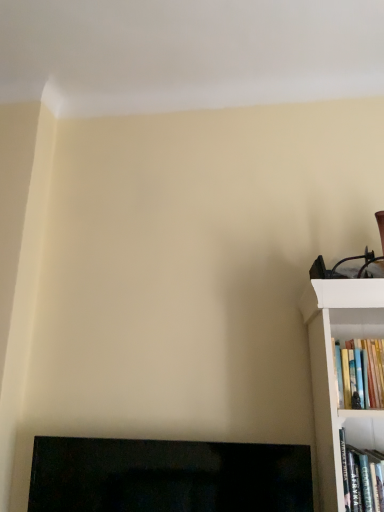
This screenshot has width=384, height=512. What are the coordinates of `hardcover book at right, the 1th book when ordered from bottom to top` in the screenshot? It's located at (361, 478).

What do you see at coordinates (168, 476) in the screenshot? The image size is (384, 512). I see `black glossy fireplace at lower left` at bounding box center [168, 476].

What is the approximate width of black glossy fireplace at lower left?

9.19 centimeters.

What do you see at coordinates (360, 373) in the screenshot?
I see `hardcover books at right, placed as the second book when sorted from bottom to top` at bounding box center [360, 373].

Where is `hardcover books at right, positioned as the first book in top-to-bottom order`? hardcover books at right, positioned as the first book in top-to-bottom order is located at coordinates (360, 373).

Locate an element on the screen. The width and height of the screenshot is (384, 512). hardcover book at right, the 1th book when ordered from bottom to top is located at coordinates (361, 478).

Considering the positions of objects hardcover book at right, the 1th book when ordered from bottom to top, and black glossy fireplace at lower left in the image provided, who is more to the right, hardcover book at right, the 1th book when ordered from bottom to top, or black glossy fireplace at lower left?

hardcover book at right, the 1th book when ordered from bottom to top.

Who is more distant, hardcover book at right, the 1th book when ordered from bottom to top, or black glossy fireplace at lower left?

black glossy fireplace at lower left.

Does hardcover book at right, which ranks as the second book in top-to-bottom order, turn towards black glossy fireplace at lower left?

No, hardcover book at right, which ranks as the second book in top-to-bottom order, is not facing towards black glossy fireplace at lower left.

Between hardcover book at right, which ranks as the second book in top-to-bottom order, and hardcover books at right, positioned as the first book in top-to-bottom order, which one has larger width?

hardcover book at right, which ranks as the second book in top-to-bottom order.

From a real-world perspective, is hardcover book at right, the 1th book when ordered from bottom to top, above or below hardcover books at right, positioned as the first book in top-to-bottom order?

From a real-world perspective, hardcover book at right, the 1th book when ordered from bottom to top, is physically below hardcover books at right, positioned as the first book in top-to-bottom order.

Is point (343, 478) closer or farther from the camera than point (345, 383)?

Point (343, 478) appears to be closer to the viewer than point (345, 383).

Is hardcover book at right, which ranks as the second book in top-to-bottom order, turned away from hardcover books at right, positioned as the first book in top-to-bottom order?

That's not correct — hardcover book at right, which ranks as the second book in top-to-bottom order, is not looking away from hardcover books at right, positioned as the first book in top-to-bottom order.

Is black glossy fireplace at lower left positioned beyond the bounds of hardcover books at right, placed as the second book when sorted from bottom to top?

Yes, black glossy fireplace at lower left is outside of hardcover books at right, placed as the second book when sorted from bottom to top.

From the image's perspective, which is below, black glossy fireplace at lower left or hardcover books at right, placed as the second book when sorted from bottom to top?

From the image's view, black glossy fireplace at lower left is below.

Considering the relative sizes of black glossy fireplace at lower left and hardcover books at right, placed as the second book when sorted from bottom to top, in the image provided, is black glossy fireplace at lower left wider than hardcover books at right, placed as the second book when sorted from bottom to top,?

No, black glossy fireplace at lower left is not wider than hardcover books at right, placed as the second book when sorted from bottom to top.

Looking at this image, which is in front, black glossy fireplace at lower left or hardcover books at right, placed as the second book when sorted from bottom to top?

hardcover books at right, placed as the second book when sorted from bottom to top, is closer to the camera.

Considering the points (140, 465) and (372, 479), which point is behind, point (140, 465) or point (372, 479)?

Point (140, 465)

Is black glossy fireplace at lower left further to camera compared to hardcover book at right, which ranks as the second book in top-to-bottom order?

Yes, black glossy fireplace at lower left is further from the viewer.

Does black glossy fireplace at lower left have a smaller size compared to hardcover book at right, which ranks as the second book in top-to-bottom order?

No.

From a real-world perspective, between black glossy fireplace at lower left and hardcover book at right, the 1th book when ordered from bottom to top, who is vertically higher?

From a 3D spatial view, hardcover book at right, the 1th book when ordered from bottom to top, is above.

Does hardcover books at right, placed as the second book when sorted from bottom to top, appear on the left side of hardcover book at right, which ranks as the second book in top-to-bottom order?

Yes.

From the image's perspective, is hardcover books at right, positioned as the first book in top-to-bottom order, positioned above or below hardcover book at right, which ranks as the second book in top-to-bottom order?

hardcover books at right, positioned as the first book in top-to-bottom order, is situated higher than hardcover book at right, which ranks as the second book in top-to-bottom order, in the image.

What's the angular difference between hardcover books at right, placed as the second book when sorted from bottom to top, and hardcover book at right, the 1th book when ordered from bottom to top,'s facing directions?

hardcover books at right, placed as the second book when sorted from bottom to top, and hardcover book at right, the 1th book when ordered from bottom to top, are facing 0.217 degrees away from each other.

From a real-world perspective, which is physically above, hardcover books at right, placed as the second book when sorted from bottom to top, or hardcover book at right, which ranks as the second book in top-to-bottom order?

hardcover books at right, placed as the second book when sorted from bottom to top, from a real-world perspective.

Does hardcover books at right, positioned as the first book in top-to-bottom order, touch black glossy fireplace at lower left?

No, hardcover books at right, positioned as the first book in top-to-bottom order, is not touching black glossy fireplace at lower left.

In terms of height, does hardcover books at right, placed as the second book when sorted from bottom to top, look taller or shorter compared to black glossy fireplace at lower left?

hardcover books at right, placed as the second book when sorted from bottom to top, is shorter than black glossy fireplace at lower left.

Which of these two, hardcover books at right, positioned as the first book in top-to-bottom order, or black glossy fireplace at lower left, is wider?

hardcover books at right, positioned as the first book in top-to-bottom order, is wider.

You are a GUI agent. You are given a task and a screenshot of the screen. Output one action in this format:
    pyautogui.click(x=<x>, y=<y>)
    Task: Click on the 1st book above the black glossy fireplace at lower left (from the image's perspective)
    
    Given the screenshot: What is the action you would take?
    pyautogui.click(x=361, y=478)

In the image, there is a hardcover books at right, placed as the second book when sorted from bottom to top. Identify the location of book below it (from the image's perspective). Image resolution: width=384 pixels, height=512 pixels. (361, 478).

Considering their positions, is hardcover books at right, positioned as the first book in top-to-bottom order, positioned closer to hardcover book at right, which ranks as the second book in top-to-bottom order, than black glossy fireplace at lower left?

Based on the image, hardcover books at right, positioned as the first book in top-to-bottom order, appears to be nearer to hardcover book at right, which ranks as the second book in top-to-bottom order.

When comparing their distances from hardcover books at right, positioned as the first book in top-to-bottom order, does black glossy fireplace at lower left or hardcover book at right, which ranks as the second book in top-to-bottom order, seem closer?

Among the two, hardcover book at right, which ranks as the second book in top-to-bottom order, is located nearer to hardcover books at right, positioned as the first book in top-to-bottom order.

Which object lies nearer to the anchor point black glossy fireplace at lower left, hardcover book at right, which ranks as the second book in top-to-bottom order, or hardcover books at right, placed as the second book when sorted from bottom to top?

hardcover book at right, which ranks as the second book in top-to-bottom order, lies closer to black glossy fireplace at lower left than the other object.

When comparing their distances from black glossy fireplace at lower left, does hardcover books at right, positioned as the first book in top-to-bottom order, or hardcover book at right, which ranks as the second book in top-to-bottom order, seem further?

The object further to black glossy fireplace at lower left is hardcover books at right, positioned as the first book in top-to-bottom order.

Considering their positions, is hardcover book at right, which ranks as the second book in top-to-bottom order, positioned closer to hardcover books at right, positioned as the first book in top-to-bottom order, than black glossy fireplace at lower left?

hardcover book at right, which ranks as the second book in top-to-bottom order, lies closer to hardcover books at right, positioned as the first book in top-to-bottom order, than the other object.

From the image, which object appears to be nearer to hardcover book at right, which ranks as the second book in top-to-bottom order, black glossy fireplace at lower left or hardcover books at right, placed as the second book when sorted from bottom to top?

Among the two, hardcover books at right, placed as the second book when sorted from bottom to top, is located nearer to hardcover book at right, which ranks as the second book in top-to-bottom order.

In order to click on book between black glossy fireplace at lower left and hardcover book at right, the 1th book when ordered from bottom to top, in the horizontal direction in this screenshot , I will do `click(360, 373)`.